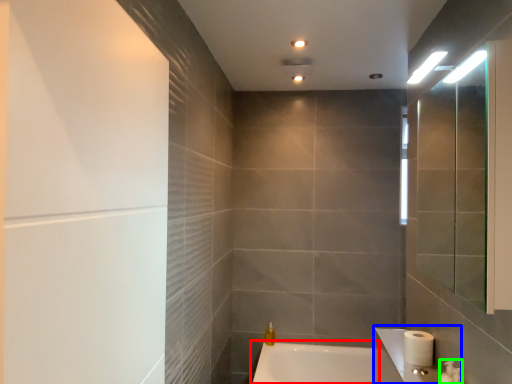
Question: Estimate the real-world distances between objects in this image. Which object is farther from bathtub (highlighted by a red box), sink (highlighted by a blue box) or plumbing fixture (highlighted by a green box)?

Choices:
 (A) sink
 (B) plumbing fixture

Answer: (B)